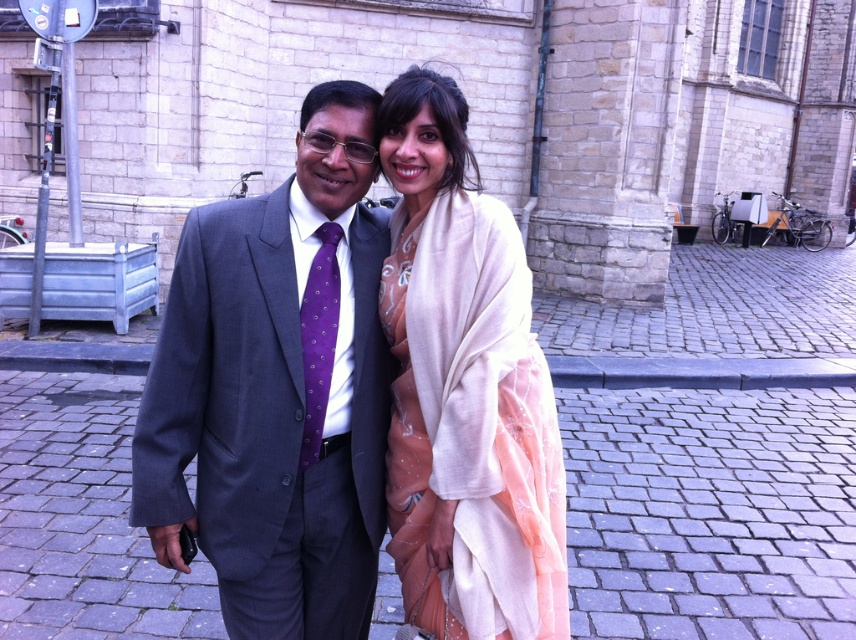
Question: Which object appears closest to the camera in this image?

Choices:
 (A) matte gray suit at center
 (B) purple silk tie at center

Answer: (A)

Question: Is matte gray suit at center bigger than purple silk tie at center?

Choices:
 (A) no
 (B) yes

Answer: (B)

Question: Where is pale beige silk scarf at center located in relation to purple silk tie at center in the image?

Choices:
 (A) below
 (B) above

Answer: (A)

Question: Among these objects, which one is farthest from the camera?

Choices:
 (A) pale beige silk scarf at center
 (B) matte gray suit at center
 (C) purple silk tie at center

Answer: (C)

Question: Which point appears farthest from the camera in this image?

Choices:
 (A) (306, 458)
 (B) (313, 189)
 (C) (492, 433)

Answer: (B)

Question: From the image, what is the correct spatial relationship of matte gray suit at center in relation to pale beige silk scarf at center?

Choices:
 (A) above
 (B) below

Answer: (B)